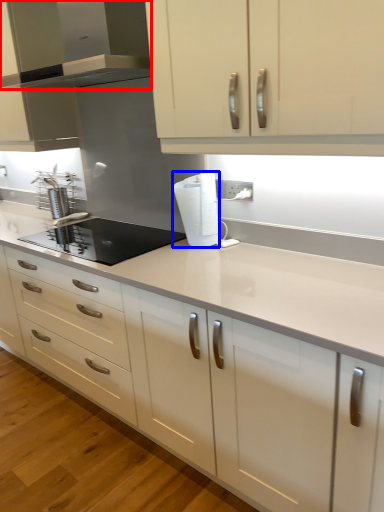
Question: Which point is closer to the camera, home appliance (highlighted by a red box) or paper towel (highlighted by a blue box)?

Choices:
 (A) home appliance
 (B) paper towel

Answer: (A)